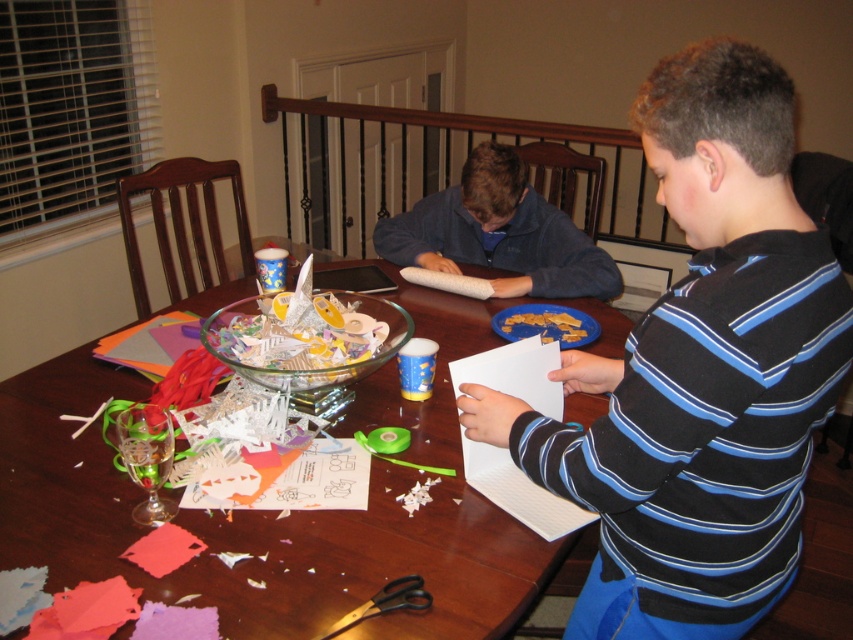
From the picture: Who is taller, wooden table at center or blue fleece sweater at center?

With more height is wooden table at center.

Measure the distance between wooden table at center and blue fleece sweater at center.

14.91 inches

Where is `wooden table at center`? The image size is (853, 640). wooden table at center is located at coordinates (279, 509).

Does point (534, 432) lie in front of point (415, 259)?

Yes, it is.

Who is lower down, blue striped shirt at center or blue fleece sweater at center?

blue striped shirt at center

Is point (666, 580) farther from viewer compared to point (437, 236)?

No.

This screenshot has height=640, width=853. Identify the location of blue striped shirt at center. (700, 371).

Can you confirm if blue striped shirt at center is positioned to the left of wooden table at center?

Incorrect, blue striped shirt at center is not on the left side of wooden table at center.

From the picture: Between blue striped shirt at center and wooden table at center, which one appears on the right side from the viewer's perspective?

Positioned to the right is blue striped shirt at center.

Does point (665, 436) lie in front of point (398, 538)?

Yes, point (665, 436) is closer to viewer.

Locate an element on the screen. The height and width of the screenshot is (640, 853). blue striped shirt at center is located at coordinates (700, 371).